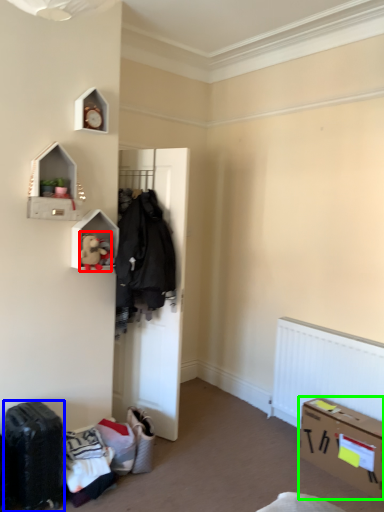
Question: Which object is positioned farthest from toy (highlighted by a red box)? Select from luggage (highlighted by a blue box) and box (highlighted by a green box).

Choices:
 (A) luggage
 (B) box

Answer: (B)